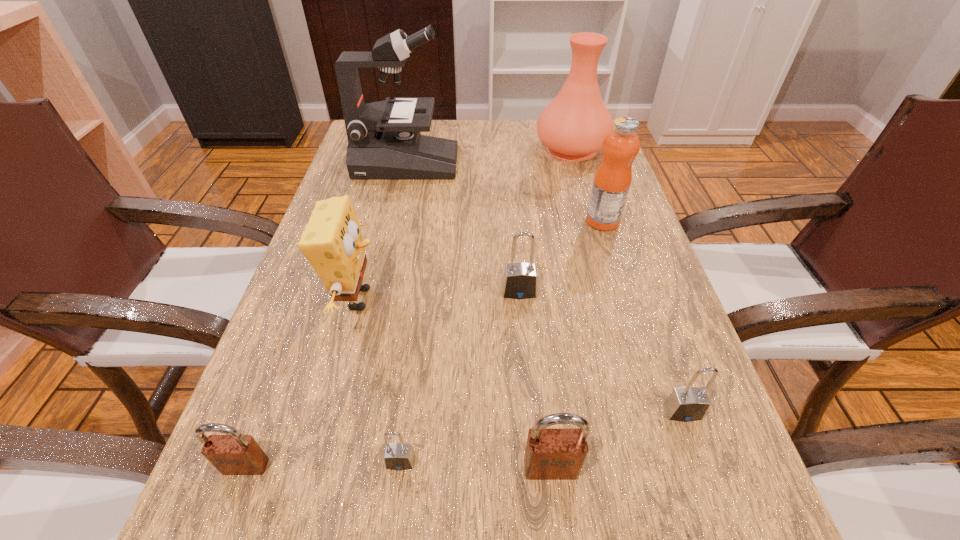
The height and width of the screenshot is (540, 960). I want to click on microscope, so click(384, 141).

Identify the location of vase. This screenshot has width=960, height=540. (573, 126).

Locate an element on the screen. The height and width of the screenshot is (540, 960). the third tallest object is located at coordinates (612, 180).

The height and width of the screenshot is (540, 960). Identify the location of the third farthest object. (612, 180).

The width and height of the screenshot is (960, 540). I want to click on sponge, so click(332, 242).

The image size is (960, 540). What are the coordinates of `the farthest padlock` in the screenshot? It's located at (520, 279).

The height and width of the screenshot is (540, 960). Identify the location of the biggest gray padlock. (520, 279).

Identify the location of the right brown padlock. (551, 454).

At what (x,y) coordinates should I click in order to perform the action: click on the second nearest gray padlock. Please return your answer as a coordinate pair (x, y). This screenshot has height=540, width=960. Looking at the image, I should click on (685, 404).

In order to click on the fourth nearest padlock in this screenshot , I will do `click(685, 404)`.